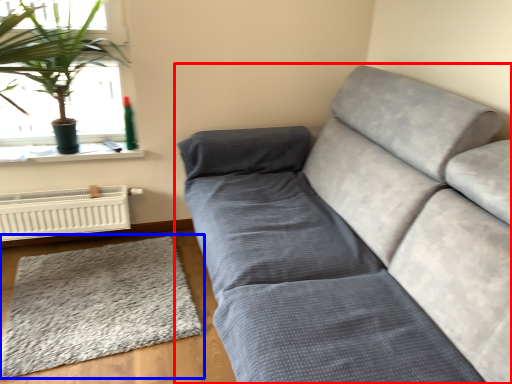
Question: Which of the following is the farthest to the observer, studio couch (highlighted by a red box) or mat (highlighted by a blue box)?

Choices:
 (A) studio couch
 (B) mat

Answer: (B)